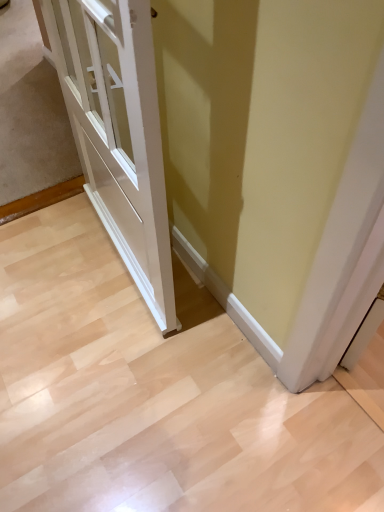
Find the location of a particular element. This screenshot has width=384, height=512. free point above light wood floor at center (from a real-world perspective) is located at coordinates (132, 391).